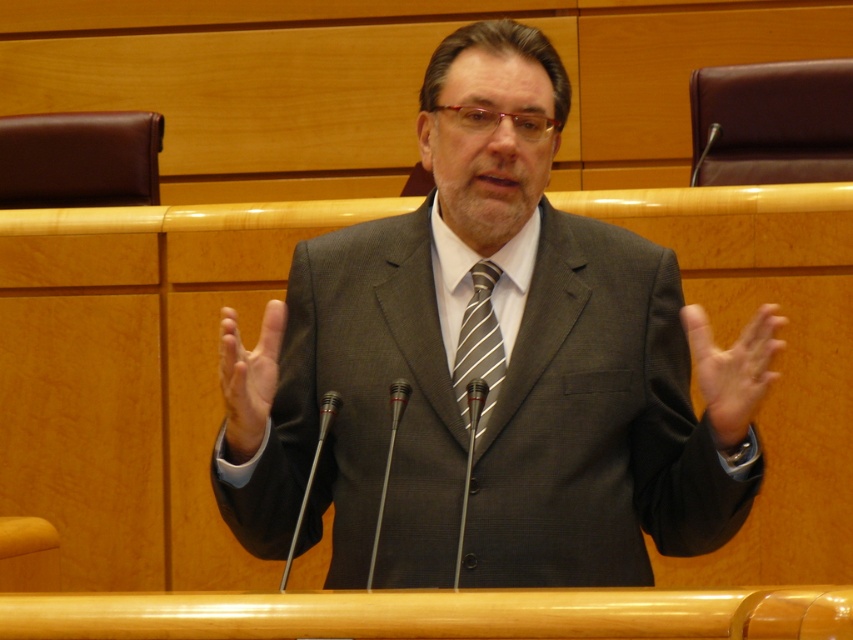
Is matte gray suit at center in front of matte gray hand at center?

No, matte gray suit at center is further to the viewer.

How far apart are matte gray suit at center and matte gray hand at center?

The distance of matte gray suit at center from matte gray hand at center is 15.74 inches.

Is point (635, 380) behind point (270, 364)?

Yes, it is.

Find the location of a particular element. This screenshot has width=853, height=640. matte gray suit at center is located at coordinates (505, 369).

How distant is matte gray suit at center from smooth skin hand at center?

A distance of 16.41 inches exists between matte gray suit at center and smooth skin hand at center.

Who is positioned more to the left, matte gray suit at center or smooth skin hand at center?

From the viewer's perspective, matte gray suit at center appears more on the left side.

Is point (343, 532) behind point (761, 337)?

Yes.

This screenshot has height=640, width=853. Find the location of `matte gray suit at center`. matte gray suit at center is located at coordinates (505, 369).

Is matte gray hand at center positioned before striped silk tie at center?

Yes, it is in front of striped silk tie at center.

Who is shorter, matte gray hand at center or striped silk tie at center?

Standing shorter between the two is matte gray hand at center.

What do you see at coordinates (248, 378) in the screenshot? I see `matte gray hand at center` at bounding box center [248, 378].

The height and width of the screenshot is (640, 853). I want to click on matte gray hand at center, so click(x=248, y=378).